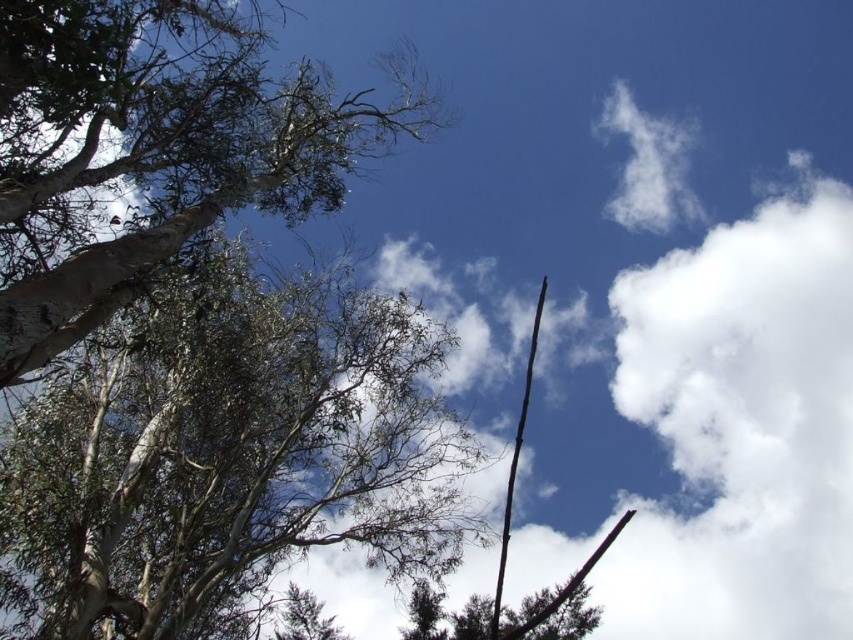
Question: Which object is the closest to the green rough bark tree at upper left?

Choices:
 (A) white fluffy cloud at upper right
 (B) green leafy tree at upper left

Answer: (B)

Question: Which of the following is the closest to the observer?

Choices:
 (A) green leafy tree at upper left
 (B) white fluffy cloud at upper right

Answer: (A)

Question: Which object is closer to the camera taking this photo?

Choices:
 (A) white fluffy cloud at upper right
 (B) green rough bark tree at upper left

Answer: (B)

Question: Does green rough bark tree at upper left have a lesser width compared to green leafy tree at upper left?

Choices:
 (A) yes
 (B) no

Answer: (A)

Question: Observing the image, what is the correct spatial positioning of green rough bark tree at upper left in reference to white fluffy cloud at upper right?

Choices:
 (A) below
 (B) above

Answer: (A)

Question: Observing the image, what is the correct spatial positioning of green rough bark tree at upper left in reference to green leafy tree at upper left?

Choices:
 (A) below
 (B) above

Answer: (A)